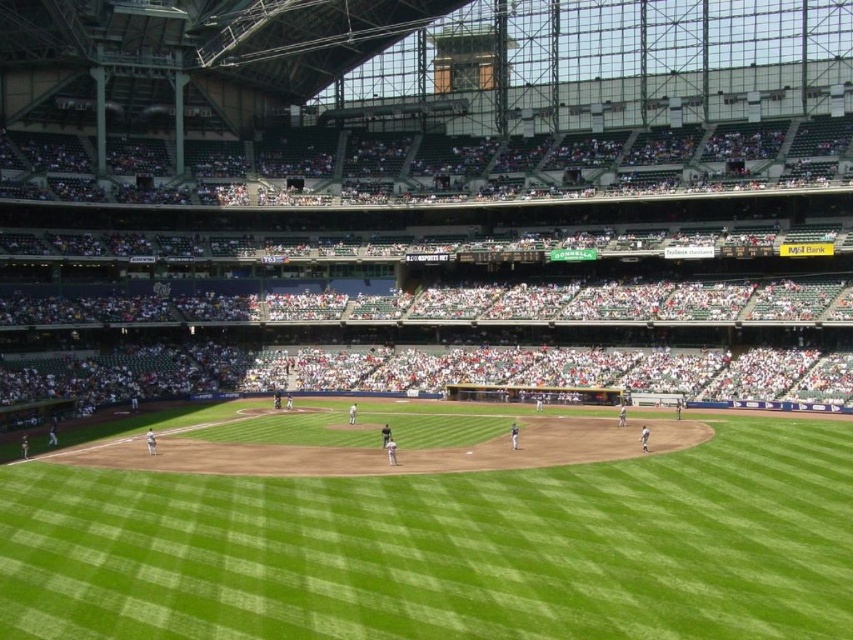
Is white plastic seats at upper center bigger than green grass field at center?

Yes.

Is point (595, 278) positioned behind point (532, 499)?

Yes.

Locate an element on the screen. white plastic seats at upper center is located at coordinates (436, 269).